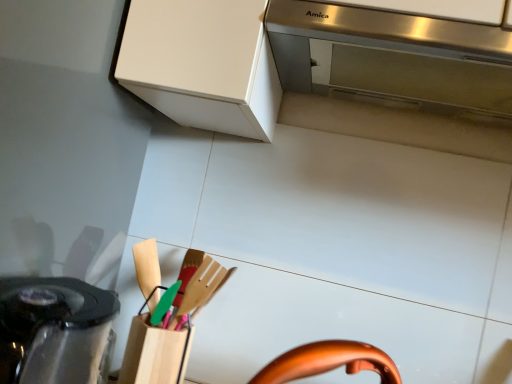
What do you see at coordinates (395, 56) in the screenshot? The height and width of the screenshot is (384, 512). I see `stainless steel range hood at upper center` at bounding box center [395, 56].

At what (x,y) coordinates should I click in order to perform the action: click on stainless steel range hood at upper center. Please return your answer as a coordinate pair (x, y). Looking at the image, I should click on (395, 56).

Image resolution: width=512 pixels, height=384 pixels. What are the coordinates of `black glossy kettle at lower left` in the screenshot? It's located at (54, 330).

What do you see at coordinates (54, 330) in the screenshot? Image resolution: width=512 pixels, height=384 pixels. I see `black glossy kettle at lower left` at bounding box center [54, 330].

The width and height of the screenshot is (512, 384). I want to click on stainless steel range hood at upper center, so click(x=395, y=56).

Can you confirm if stainless steel range hood at upper center is positioned to the right of black glossy kettle at lower left?

Yes, stainless steel range hood at upper center is to the right of black glossy kettle at lower left.

Is stainless steel range hood at upper center closer to camera compared to black glossy kettle at lower left?

No, the depth of stainless steel range hood at upper center is greater than that of black glossy kettle at lower left.

Considering the positions of point (424, 71) and point (26, 350), is point (424, 71) closer or farther from the camera than point (26, 350)?

Point (424, 71) is positioned farther from the camera compared to point (26, 350).

From the image's perspective, is stainless steel range hood at upper center below black glossy kettle at lower left?

Incorrect, from the image's perspective, stainless steel range hood at upper center is higher than black glossy kettle at lower left.

From a real-world perspective, who is located lower, stainless steel range hood at upper center or black glossy kettle at lower left?

From a 3D spatial view, black glossy kettle at lower left is below.

In terms of width, does stainless steel range hood at upper center look wider or thinner when compared to black glossy kettle at lower left?

stainless steel range hood at upper center is wider than black glossy kettle at lower left.

Can you confirm if stainless steel range hood at upper center is taller than black glossy kettle at lower left?

Incorrect, the height of stainless steel range hood at upper center is not larger of that of black glossy kettle at lower left.

Who is bigger, stainless steel range hood at upper center or black glossy kettle at lower left?

black glossy kettle at lower left.

Would you say stainless steel range hood at upper center contains black glossy kettle at lower left?

Actually, black glossy kettle at lower left is outside stainless steel range hood at upper center.

Is stainless steel range hood at upper center in contact with black glossy kettle at lower left?

stainless steel range hood at upper center is not next to black glossy kettle at lower left, and they're not touching.

Does stainless steel range hood at upper center turn towards black glossy kettle at lower left?

No, stainless steel range hood at upper center is not facing towards black glossy kettle at lower left.

How far apart are stainless steel range hood at upper center and black glossy kettle at lower left?

stainless steel range hood at upper center is 50.10 centimeters away from black glossy kettle at lower left.

At what (x,y) coordinates should I click in order to perform the action: click on home appliance to the right of black glossy kettle at lower left. Please return your answer as a coordinate pair (x, y). This screenshot has height=384, width=512. Looking at the image, I should click on (395, 56).

Is black glossy kettle at lower left at the right side of stainless steel range hood at upper center?

In fact, black glossy kettle at lower left is to the left of stainless steel range hood at upper center.

Which object is closer to the camera taking this photo, black glossy kettle at lower left or stainless steel range hood at upper center?

black glossy kettle at lower left is in front.

Considering the points (12, 381) and (490, 66), which point is in front, point (12, 381) or point (490, 66)?

Point (12, 381)

From the image's perspective, does black glossy kettle at lower left appear lower than stainless steel range hood at upper center?

Yes, from the image's perspective, black glossy kettle at lower left is below stainless steel range hood at upper center.

From a real-world perspective, is black glossy kettle at lower left positioned above or below stainless steel range hood at upper center?

From a real-world perspective, black glossy kettle at lower left is physically below stainless steel range hood at upper center.

Considering the sizes of objects black glossy kettle at lower left and stainless steel range hood at upper center in the image provided, who is wider, black glossy kettle at lower left or stainless steel range hood at upper center?

stainless steel range hood at upper center.

Considering the sizes of objects black glossy kettle at lower left and stainless steel range hood at upper center in the image provided, who is shorter, black glossy kettle at lower left or stainless steel range hood at upper center?

With less height is stainless steel range hood at upper center.

Which of these two, black glossy kettle at lower left or stainless steel range hood at upper center, is bigger?

black glossy kettle at lower left is bigger.

Which is correct: black glossy kettle at lower left is inside stainless steel range hood at upper center, or outside of it?

The correct answer is: outside.

Is black glossy kettle at lower left not close to stainless steel range hood at upper center?

No, black glossy kettle at lower left is not far away from stainless steel range hood at upper center.

Could you tell me if black glossy kettle at lower left is turned towards stainless steel range hood at upper center?

No, black glossy kettle at lower left is not facing towards stainless steel range hood at upper center.

Locate an element on the screen. The width and height of the screenshot is (512, 384). kitchen appliance in front of the stainless steel range hood at upper center is located at coordinates (54, 330).

The image size is (512, 384). Find the location of `kitchen appliance in front of the stainless steel range hood at upper center`. kitchen appliance in front of the stainless steel range hood at upper center is located at coordinates (x=54, y=330).

At what (x,y) coordinates should I click in order to perform the action: click on kitchen appliance below the stainless steel range hood at upper center (from a real-world perspective). Please return your answer as a coordinate pair (x, y). Looking at the image, I should click on (54, 330).